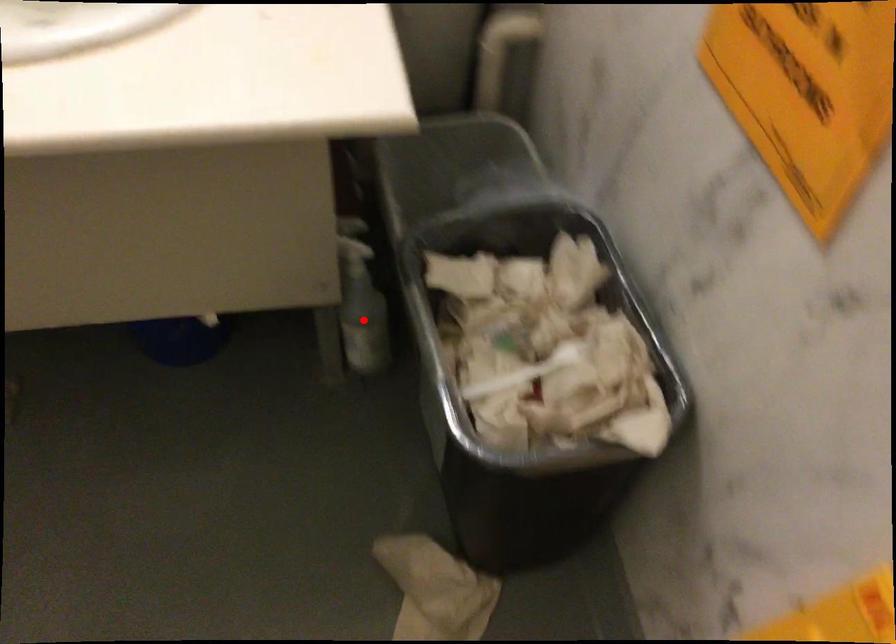
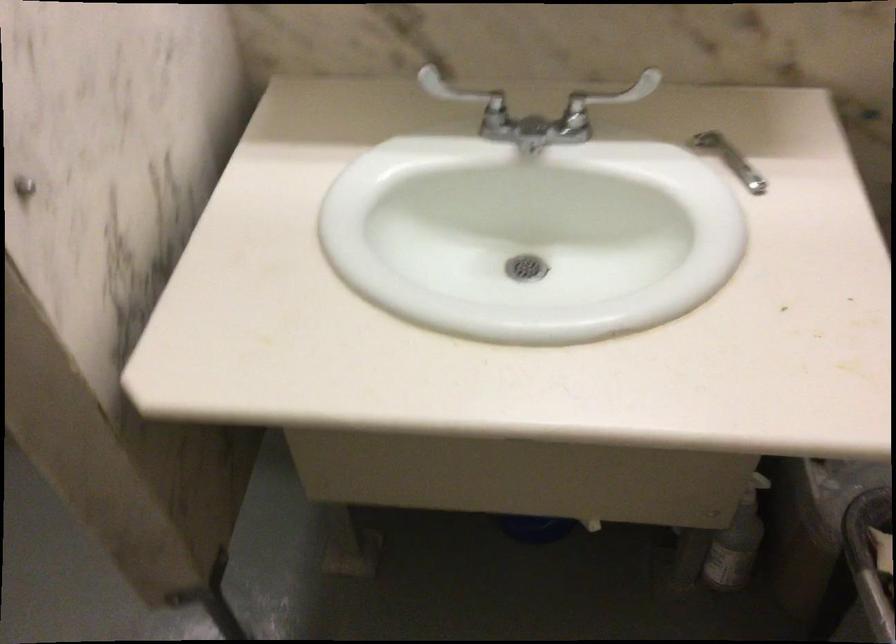
Where in the second image is the point corresponding to the highlighted location from the first image?

(737, 542)